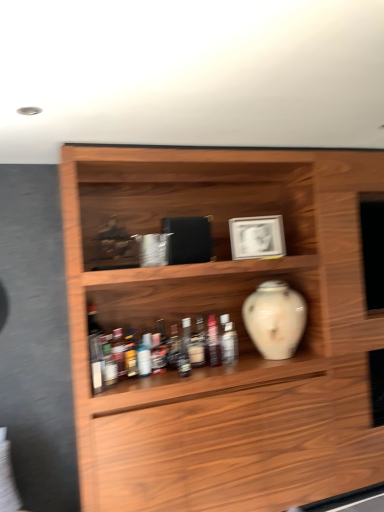
What do you see at coordinates (229, 344) in the screenshot? The image size is (384, 512). I see `translucent plastic bottle at center, acting as the second bottle starting from the front` at bounding box center [229, 344].

This screenshot has height=512, width=384. Describe the element at coordinates (213, 342) in the screenshot. I see `translucent glass bottle at center, which is counted as the first bottle, starting from the back` at that location.

Image resolution: width=384 pixels, height=512 pixels. I want to click on translucent plastic bottles at lower center, which is counted as the 1th bottle, starting from the front, so click(x=118, y=351).

Image resolution: width=384 pixels, height=512 pixels. Describe the element at coordinates (118, 351) in the screenshot. I see `translucent plastic bottles at lower center, placed as the 1th bottle when sorted from left to right` at that location.

In order to face white matte picture frame at upper center, should I rotate leftwards or rightwards?

Turn right by 8.642 degrees to look at white matte picture frame at upper center.

Where is `wooden shelf at center`? wooden shelf at center is located at coordinates (237, 330).

Find the location of a particular element. This screenshot has width=384, height=512. translucent plastic bottle at center, acting as the 2th bottle starting from the back is located at coordinates (229, 344).

Considering their positions, is translucent plastic bottles at lower center, placed as the third bottle when sorted from right to left, located in front of or behind white matte picture frame at upper center?

translucent plastic bottles at lower center, placed as the third bottle when sorted from right to left, is in front of white matte picture frame at upper center.

This screenshot has width=384, height=512. I want to click on the 2nd bottle below the white matte picture frame at upper center (from a real-world perspective), so click(x=118, y=351).

In the scene shown: From the image's perspective, which is above, translucent plastic bottles at lower center, placed as the 1th bottle when sorted from left to right, or white matte picture frame at upper center?

white matte picture frame at upper center appears higher in the image.

Can you confirm if white glossy vase at center is shorter than white matte picture frame at upper center?

In fact, white glossy vase at center may be taller than white matte picture frame at upper center.

From the image's perspective, between white glossy vase at center and white matte picture frame at upper center, which one is located above?

white matte picture frame at upper center.

Measure the distance between white glossy vase at center and white matte picture frame at upper center.

15.31 inches.

Between white glossy vase at center and white matte picture frame at upper center, which one has smaller size?

white matte picture frame at upper center is smaller.

In the scene shown: From the image's perspective, who appears lower, translucent plastic bottle at center, acting as the second bottle starting from the front, or white glossy vase at center?

translucent plastic bottle at center, acting as the second bottle starting from the front, appears lower in the image.

In terms of height, does translucent plastic bottle at center, acting as the first bottle starting from the right, look taller or shorter compared to white glossy vase at center?

translucent plastic bottle at center, acting as the first bottle starting from the right, is shorter than white glossy vase at center.

Does translucent plastic bottle at center, the third bottle when ordered from left to right, have a greater width compared to white glossy vase at center?

No, translucent plastic bottle at center, the third bottle when ordered from left to right, is not wider than white glossy vase at center.

Measure the distance between translucent plastic bottle at center, acting as the second bottle starting from the front, and white glossy vase at center.

They are 11.47 inches apart.

From the image's perspective, who appears lower, translucent plastic bottles at lower center, which is the third bottle from back to front, or wooden shelf at center?

translucent plastic bottles at lower center, which is the third bottle from back to front, is shown below in the image.

How far apart are translucent plastic bottles at lower center, placed as the 1th bottle when sorted from left to right, and wooden shelf at center?

They are 37.15 inches apart.

Considering the relative sizes of translucent plastic bottles at lower center, which is counted as the 1th bottle, starting from the front, and wooden shelf at center in the image provided, is translucent plastic bottles at lower center, which is counted as the 1th bottle, starting from the front, thinner than wooden shelf at center?

Yes, translucent plastic bottles at lower center, which is counted as the 1th bottle, starting from the front, is thinner than wooden shelf at center.

Choose the correct answer: Is translucent plastic bottles at lower center, placed as the third bottle when sorted from right to left, inside wooden shelf at center or outside it?

translucent plastic bottles at lower center, placed as the third bottle when sorted from right to left, is enclosed within wooden shelf at center.

Consider the image. Looking at their sizes, would you say wooden shelf at center is wider or thinner than translucent plastic bottle at center, the third bottle when ordered from left to right?

wooden shelf at center is wider than translucent plastic bottle at center, the third bottle when ordered from left to right.

From the image's perspective, starting from the wooden shelf at center, which bottle is the 2nd one below? Please provide its 2D coordinates.

[(229, 344)]

In terms of size, does wooden shelf at center appear bigger or smaller than translucent plastic bottle at center, acting as the second bottle starting from the front?

Clearly, wooden shelf at center is larger in size than translucent plastic bottle at center, acting as the second bottle starting from the front.

Considering the sizes of objects white matte picture frame at upper center and translucent plastic bottle at center, acting as the first bottle starting from the right, in the image provided, who is shorter, white matte picture frame at upper center or translucent plastic bottle at center, acting as the first bottle starting from the right,?

Standing shorter between the two is translucent plastic bottle at center, acting as the first bottle starting from the right.

Are white matte picture frame at upper center and translucent plastic bottle at center, the third bottle when ordered from left to right, beside each other?

No, white matte picture frame at upper center is not in contact with translucent plastic bottle at center, the third bottle when ordered from left to right.

Considering the sizes of white matte picture frame at upper center and translucent plastic bottle at center, acting as the first bottle starting from the right, in the image, is white matte picture frame at upper center bigger or smaller than translucent plastic bottle at center, acting as the first bottle starting from the right,?

white matte picture frame at upper center is bigger than translucent plastic bottle at center, acting as the first bottle starting from the right.

From the image's perspective, would you say white matte picture frame at upper center is positioned over translucent plastic bottle at center, acting as the first bottle starting from the right?

Yes, from the image's perspective, white matte picture frame at upper center is on top of translucent plastic bottle at center, acting as the first bottle starting from the right.

The width and height of the screenshot is (384, 512). Identify the location of shelf in front of the white matte picture frame at upper center. (237, 330).

Based on the photo, do you think white matte picture frame at upper center is within wooden shelf at center, or outside of it?

white matte picture frame at upper center can be found inside wooden shelf at center.

From the image's perspective, relative to wooden shelf at center, is white matte picture frame at upper center above or below?

white matte picture frame at upper center is situated higher than wooden shelf at center in the image.

Can you confirm if white matte picture frame at upper center is taller than wooden shelf at center?

In fact, white matte picture frame at upper center may be shorter than wooden shelf at center.

This screenshot has height=512, width=384. Identify the location of bottle that is the 2nd object directly below the white matte picture frame at upper center (from a real-world perspective). (118, 351).

This screenshot has width=384, height=512. I want to click on picture frame on the left of white glossy vase at center, so click(x=257, y=237).

Estimate the real-world distances between objects in this image. Which object is further from translucent plastic bottles at lower center, placed as the 1th bottle when sorted from left to right, wooden shelf at center or translucent plastic bottle at center, the third bottle when ordered from left to right?

Based on the image, wooden shelf at center appears to be further to translucent plastic bottles at lower center, placed as the 1th bottle when sorted from left to right.

Estimate the real-world distances between objects in this image. Which object is further from translucent plastic bottle at center, the third bottle when ordered from left to right, white glossy vase at center or translucent glass bottle at center, which is counted as the first bottle, starting from the back?

white glossy vase at center is further to translucent plastic bottle at center, the third bottle when ordered from left to right.

Estimate the real-world distances between objects in this image. Which object is further from translucent plastic bottle at center, the third bottle when ordered from left to right, white matte picture frame at upper center or translucent glass bottle at center, which is counted as the first bottle, starting from the back?

The object further to translucent plastic bottle at center, the third bottle when ordered from left to right, is white matte picture frame at upper center.

Looking at the image, which one is located closer to translucent plastic bottles at lower center, placed as the third bottle when sorted from right to left, translucent plastic bottle at center, acting as the second bottle starting from the front, or translucent glass bottle at center, which is counted as the first bottle, starting from the back?

translucent glass bottle at center, which is counted as the first bottle, starting from the back.

Which object lies nearer to the anchor point translucent plastic bottle at center, acting as the second bottle starting from the front, wooden shelf at center or white matte picture frame at upper center?

Among the two, white matte picture frame at upper center is located nearer to translucent plastic bottle at center, acting as the second bottle starting from the front.

In the scene shown: Which object lies nearer to the anchor point translucent glass bottle at center, which is counted as the first bottle, starting from the back, wooden shelf at center or white glossy vase at center?

Among the two, white glossy vase at center is located nearer to translucent glass bottle at center, which is counted as the first bottle, starting from the back.

When comparing their distances from translucent plastic bottles at lower center, which is counted as the 1th bottle, starting from the front, does translucent glass bottle at center, which is counted as the first bottle, starting from the back, or translucent plastic bottle at center, acting as the second bottle starting from the front, seem closer?

translucent glass bottle at center, which is counted as the first bottle, starting from the back, is closer to translucent plastic bottles at lower center, which is counted as the 1th bottle, starting from the front.

Based on their spatial positions, is translucent glass bottle at center, arranged as the second bottle when viewed from the right, or wooden shelf at center further from white glossy vase at center?

wooden shelf at center lies further to white glossy vase at center than the other object.

Identify the location of shelf located between translucent plastic bottles at lower center, placed as the 1th bottle when sorted from left to right, and white glossy vase at center in the left-right direction. The width and height of the screenshot is (384, 512). (237, 330).

Identify the location of shelf between white matte picture frame at upper center and translucent glass bottle at center, arranged as the second bottle when viewed from the right, in the vertical direction. This screenshot has height=512, width=384. (237, 330).

The height and width of the screenshot is (512, 384). Find the location of `picture frame between translucent plastic bottles at lower center, placed as the third bottle when sorted from right to left, and wooden shelf at center`. picture frame between translucent plastic bottles at lower center, placed as the third bottle when sorted from right to left, and wooden shelf at center is located at coordinates (257, 237).

You are a GUI agent. You are given a task and a screenshot of the screen. Output one action in this format:
    pyautogui.click(x=<x>, y=<y>)
    Task: Click on the bottle located between translucent plastic bottles at lower center, placed as the 1th bottle when sorted from left to right, and translucent plastic bottle at center, acting as the first bottle starting from the right, in the left-right direction
    This screenshot has height=512, width=384.
    Given the screenshot: What is the action you would take?
    pyautogui.click(x=213, y=342)